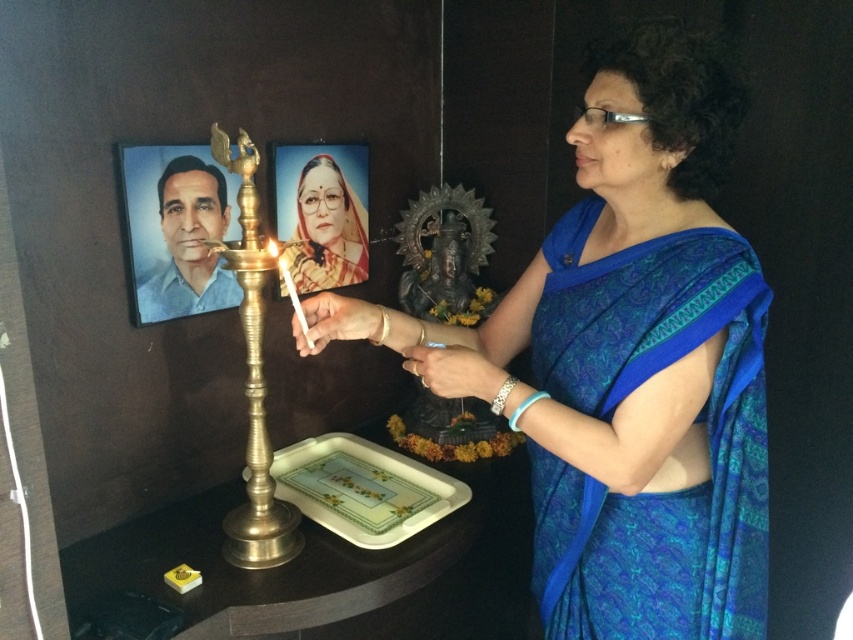
Based on the photo, you are a photographer standing at a certain distance from the scene. You want to capture a closeup shot of the blue silk saree at center. Based on the description, is the current distance sufficient to get a clear closeup without moving closer?

The blue silk saree at center is 38.96 inches away from camera. A typical camera lens can focus clearly at this distance, so the current distance is sufficient to capture a clear closeup of the blue silk saree at center without needing to move closer.

You are an interior designer planning to place a new decorative item between the gold brass candle holder at center and the matte yellow portrait at upper center. Considering their sizes, which object should you place closer to the smaller one to maintain visual balance?

The matte yellow portrait at upper center is smaller, so placing the new decorative item closer to it would help maintain visual balance by counterbalancing the larger gold brass candle holder at center.

In the scene shown: You are a guest at this event and want to place a small gift on the green glossy tray at center. However, you notice the matte yellow portrait at upper center nearby. Can the gift fit on the tray without overlapping the portrait?

The green glossy tray at center is bigger than the matte yellow portrait at upper center, so the gift can fit on the tray without overlapping the portrait as there is enough space.